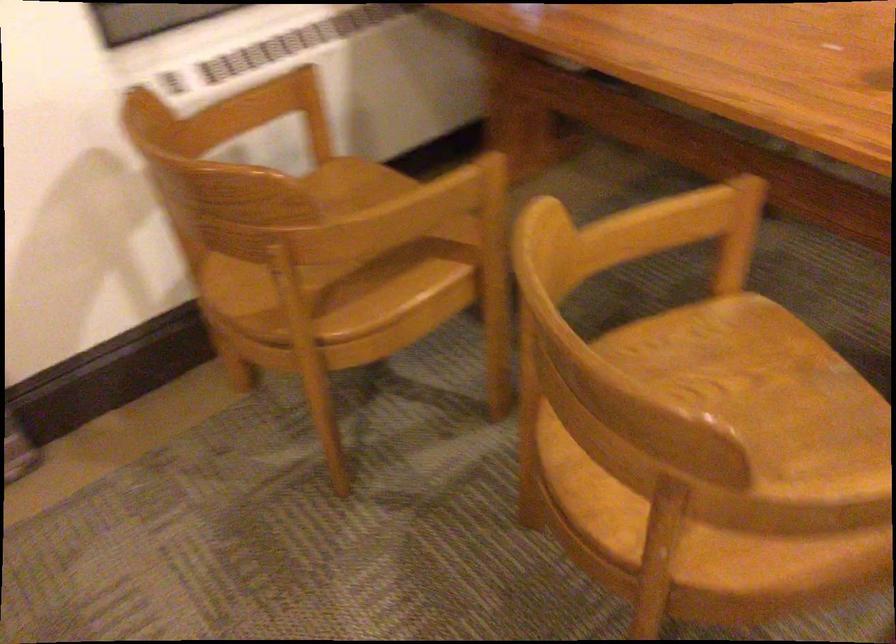
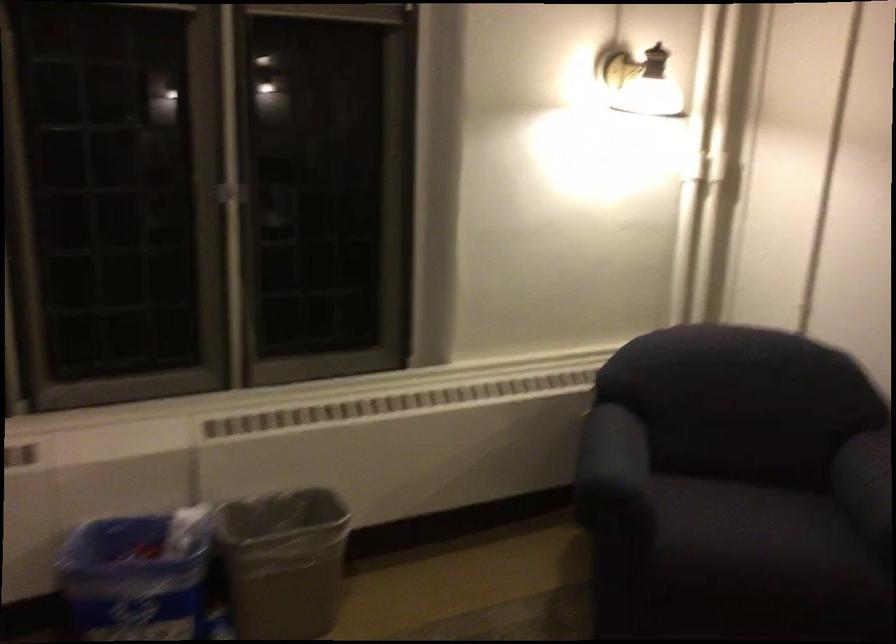
Question: The first image is from the beginning of the video and the second image is from the end. How did the camera likely rotate when shooting the video?

Choices:
 (A) Left
 (B) Right
 (C) Up
 (D) Down

Answer: (B)